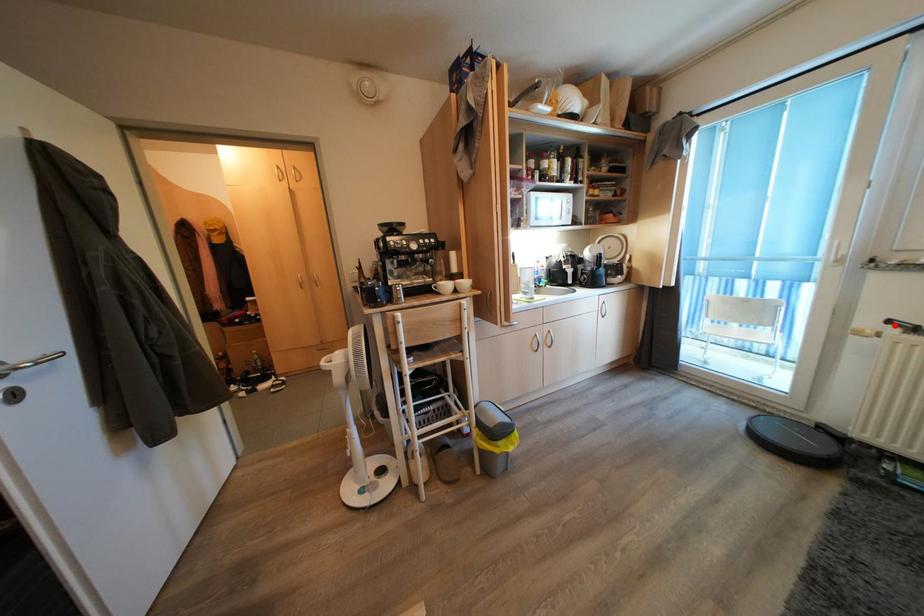
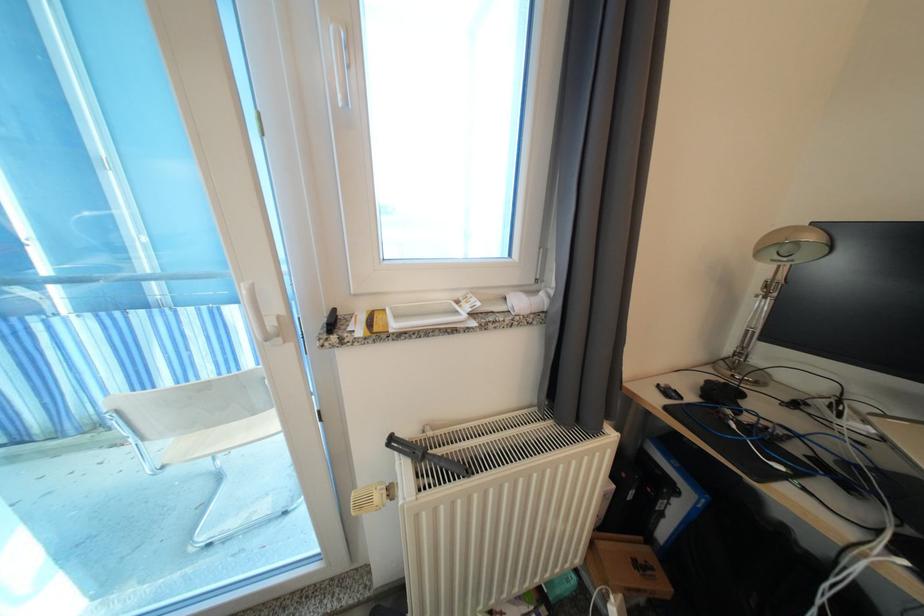
Where in the second image is the point corresponding to the highlighted location from the first image?

(395, 445)